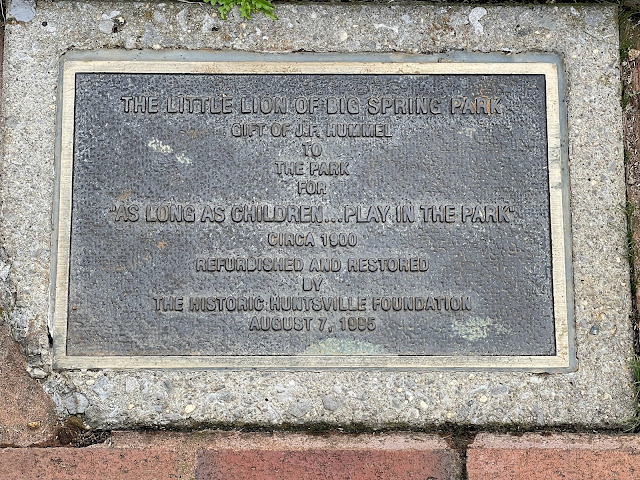
Locate an element on the screen. Image resolution: width=640 pixels, height=480 pixels. white border between the plaque section and the stone border is located at coordinates (438, 364), (555, 176), (292, 71), (64, 205), (141, 365).